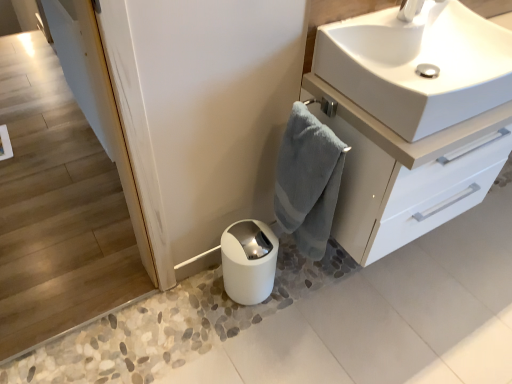
What do you see at coordinates (249, 261) in the screenshot?
I see `white glossy toilet paper at lower center` at bounding box center [249, 261].

What is the approximate width of white glossy sink at upper right?

white glossy sink at upper right is 41.40 centimeters wide.

Identify the location of white glossy cabinet at upper right. click(406, 172).

From the picture: Is white glossy cabinet at upper right closer to camera compared to gray cotton towel at center-right?

Yes, it is.

Is gray cotton towel at center-right completely or partially inside white glossy cabinet at upper right?

That's incorrect, gray cotton towel at center-right is not inside white glossy cabinet at upper right.

From a real-world perspective, which object stands above the other?

white glossy cabinet at upper right.

In terms of height, does white glossy cabinet at upper right look taller or shorter compared to gray cotton towel at center-right?

Clearly, white glossy cabinet at upper right is shorter compared to gray cotton towel at center-right.

In the scene shown: Does white glossy toilet paper at lower center have a greater height compared to white glossy sink at upper right?

Yes, white glossy toilet paper at lower center is taller than white glossy sink at upper right.

Is white glossy toilet paper at lower center inside the boundaries of white glossy sink at upper right, or outside?

white glossy toilet paper at lower center is spatially situated outside white glossy sink at upper right.

Which of these two, white glossy toilet paper at lower center or white glossy sink at upper right, is wider?

With larger width is white glossy sink at upper right.

Is the depth of white glossy toilet paper at lower center less than that of white glossy cabinet at upper right?

No, it is not.

Can we say white glossy toilet paper at lower center lies outside white glossy cabinet at upper right?

Yes.

Is white glossy toilet paper at lower center facing away from white glossy cabinet at upper right?

No, white glossy toilet paper at lower center is not facing the opposite direction of white glossy cabinet at upper right.

Can we say gray cotton towel at center-right lies outside white glossy sink at upper right?

Yes, gray cotton towel at center-right is located beyond the bounds of white glossy sink at upper right.

Which of these two, gray cotton towel at center-right or white glossy sink at upper right, stands taller?

gray cotton towel at center-right.

Where is `sink on the right of gray cotton towel at center-right`? The height and width of the screenshot is (384, 512). sink on the right of gray cotton towel at center-right is located at coordinates (416, 66).

Which of these two, gray cotton towel at center-right or white glossy sink at upper right, is smaller?

With smaller size is gray cotton towel at center-right.

Based on their sizes in the image, would you say white glossy sink at upper right is bigger or smaller than white glossy cabinet at upper right?

In the image, white glossy sink at upper right appears to be smaller than white glossy cabinet at upper right.

Can you see white glossy sink at upper right touching white glossy cabinet at upper right?

They are not placed beside each other.

Does point (443, 116) come farther from viewer compared to point (471, 154)?

No, (443, 116) is closer to viewer.

From a real-world perspective, relative to white glossy cabinet at upper right, is white glossy sink at upper right vertically above or below?

white glossy sink at upper right is above white glossy cabinet at upper right.

From the image's perspective, between white glossy sink at upper right and gray cotton towel at center-right, which one is located above?

white glossy sink at upper right appears higher in the image.

What's the angular difference between white glossy sink at upper right and gray cotton towel at center-right's facing directions?

90.6 degrees separate the facing orientations of white glossy sink at upper right and gray cotton towel at center-right.

Which object is positioned more to the right, white glossy sink at upper right or gray cotton towel at center-right?

From the viewer's perspective, white glossy sink at upper right appears more on the right side.

Would you say gray cotton towel at center-right is part of white glossy sink at upper right's contents?

That's incorrect, gray cotton towel at center-right is not inside white glossy sink at upper right.

Is white glossy sink at upper right facing away from white glossy toilet paper at lower center?

No, white glossy sink at upper right is not facing away from white glossy toilet paper at lower center.

From a real-world perspective, who is located higher, white glossy sink at upper right or white glossy toilet paper at lower center?

From a 3D spatial view, white glossy sink at upper right is above.

Consider the image. Considering the sizes of white glossy sink at upper right and white glossy toilet paper at lower center in the image, is white glossy sink at upper right bigger or smaller than white glossy toilet paper at lower center?

Clearly, white glossy sink at upper right is larger in size than white glossy toilet paper at lower center.

Which is behind, point (416, 88) or point (256, 239)?

Positioned behind is point (256, 239).

Find the location of a particular element. This screenshot has height=384, width=512. bathroom cabinet in front of the gray cotton towel at center-right is located at coordinates (406, 172).

This screenshot has height=384, width=512. I want to click on toilet paper lying behind the white glossy sink at upper right, so click(249, 261).

Which object lies further to the anchor point white glossy sink at upper right, white glossy cabinet at upper right or gray cotton towel at center-right?

The object further to white glossy sink at upper right is gray cotton towel at center-right.

From the image, which object appears to be farther from white glossy cabinet at upper right, white glossy sink at upper right or gray cotton towel at center-right?

The object further to white glossy cabinet at upper right is white glossy sink at upper right.

From the image, which object appears to be farther from white glossy sink at upper right, white glossy toilet paper at lower center or gray cotton towel at center-right?

Based on the image, white glossy toilet paper at lower center appears to be further to white glossy sink at upper right.

Considering their positions, is gray cotton towel at center-right positioned further to white glossy cabinet at upper right than white glossy sink at upper right?

Based on the image, white glossy sink at upper right appears to be further to white glossy cabinet at upper right.

Considering their positions, is gray cotton towel at center-right positioned further to white glossy toilet paper at lower center than white glossy cabinet at upper right?

white glossy cabinet at upper right is positioned further to the anchor white glossy toilet paper at lower center.

Estimate the real-world distances between objects in this image. Which object is further from gray cotton towel at center-right, white glossy sink at upper right or white glossy toilet paper at lower center?

white glossy sink at upper right lies further to gray cotton towel at center-right than the other object.

Based on their spatial positions, is white glossy toilet paper at lower center or white glossy sink at upper right further from gray cotton towel at center-right?

Among the two, white glossy sink at upper right is located further to gray cotton towel at center-right.

When comparing their distances from white glossy sink at upper right, does gray cotton towel at center-right or white glossy toilet paper at lower center seem further?

white glossy toilet paper at lower center lies further to white glossy sink at upper right than the other object.

Where is `sink between white glossy toilet paper at lower center and white glossy cabinet at upper right in the horizontal direction`? This screenshot has width=512, height=384. sink between white glossy toilet paper at lower center and white glossy cabinet at upper right in the horizontal direction is located at coordinates (416, 66).

The height and width of the screenshot is (384, 512). What are the coordinates of `bath towel between white glossy toilet paper at lower center and white glossy cabinet at upper right` in the screenshot? It's located at (308, 181).

Locate an element on the screen. The width and height of the screenshot is (512, 384). bath towel between white glossy sink at upper right and white glossy toilet paper at lower center in the up-down direction is located at coordinates (308, 181).

Locate an element on the screen. Image resolution: width=512 pixels, height=384 pixels. sink situated between gray cotton towel at center-right and white glossy cabinet at upper right from left to right is located at coordinates (416, 66).